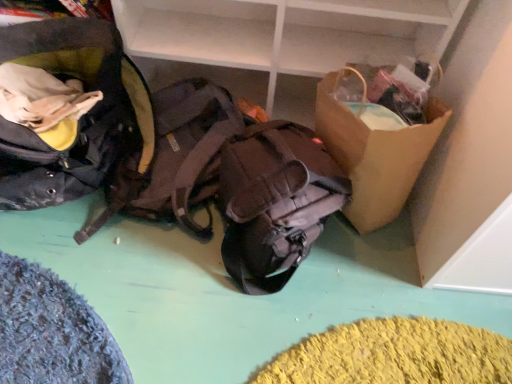
The image size is (512, 384). I want to click on vacant area that lies in front of matte black backpack at left, positioned as the 3th backpack in right-to-left order, so click(73, 296).